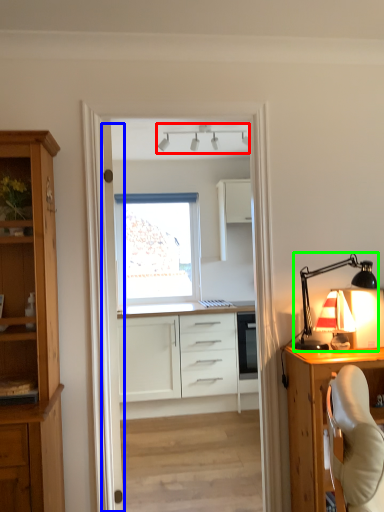
Question: Estimate the real-world distances between objects in this image. Which object is closer to lamp (highlighted by a red box), door (highlighted by a blue box) or lamp (highlighted by a green box)?

Choices:
 (A) door
 (B) lamp

Answer: (B)